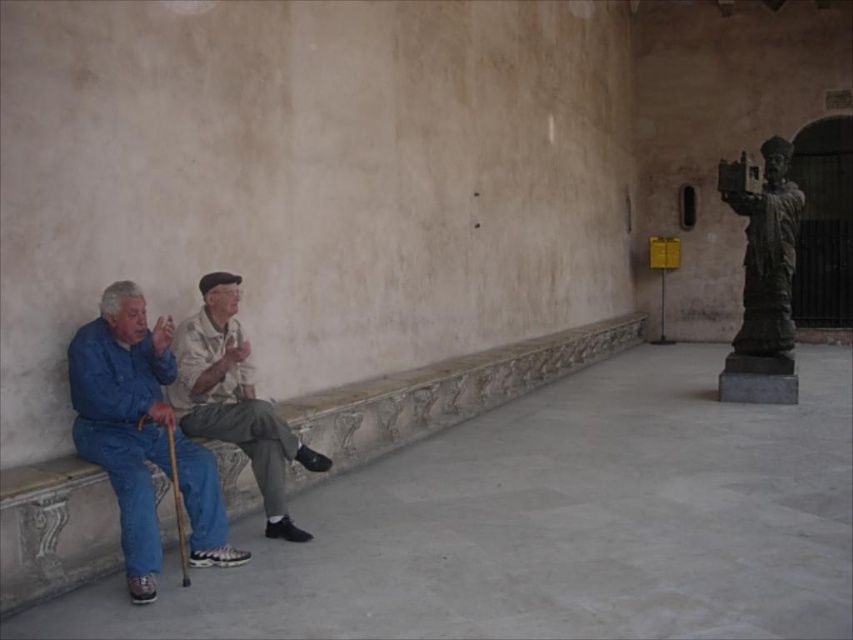
You are standing in front of the wall and want to place a small potted plant between the blue denim jeans at left and the statue on the right. Based on their positions, where should you place the plant?

The blue denim jeans at left is located at point [141,435]. Since the statue is on the right side of the frame, the plant should be placed midway between these two points to ensure it is centered between them.

Looking at this image, in the scene with two elderly men sitting on a stone bench, one wearing blue denim jeans at left and the other in khaki fabric pants at center, which man is positioned closer to the left side of the bench?

The man wearing blue denim jeans at left is closer to the left side of the bench since he is positioned to the left of the khaki fabric pants at center.